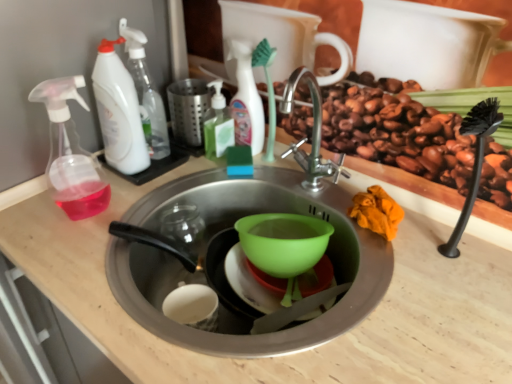
The image size is (512, 384). What are the coordinates of `empty space that is in between transparent plastic spray bottle at left and green liquid soap at upper center, positioned as the second cleaning product in right-to-left order` in the screenshot? It's located at (160, 179).